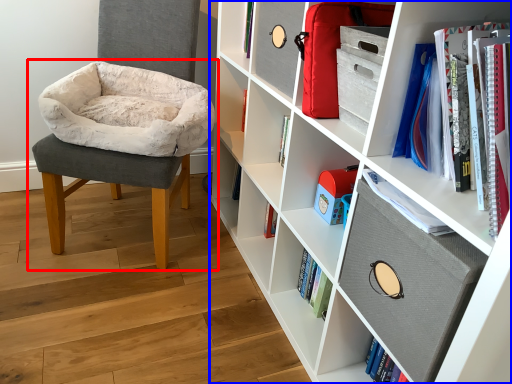
Question: Which object is closer to the camera taking this photo, chair (highlighted by a red box) or shelf (highlighted by a blue box)?

Choices:
 (A) chair
 (B) shelf

Answer: (B)